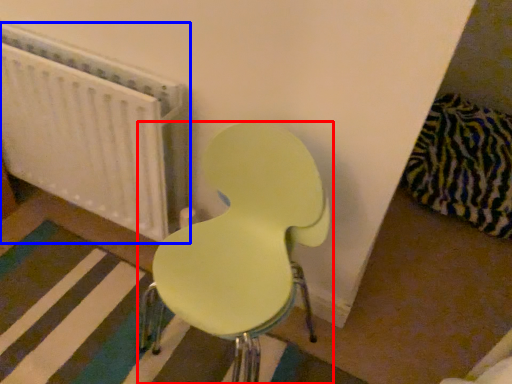
Question: Among these objects, which one is farthest to the camera, chair (highlighted by a red box) or radiator (highlighted by a blue box)?

Choices:
 (A) chair
 (B) radiator

Answer: (B)